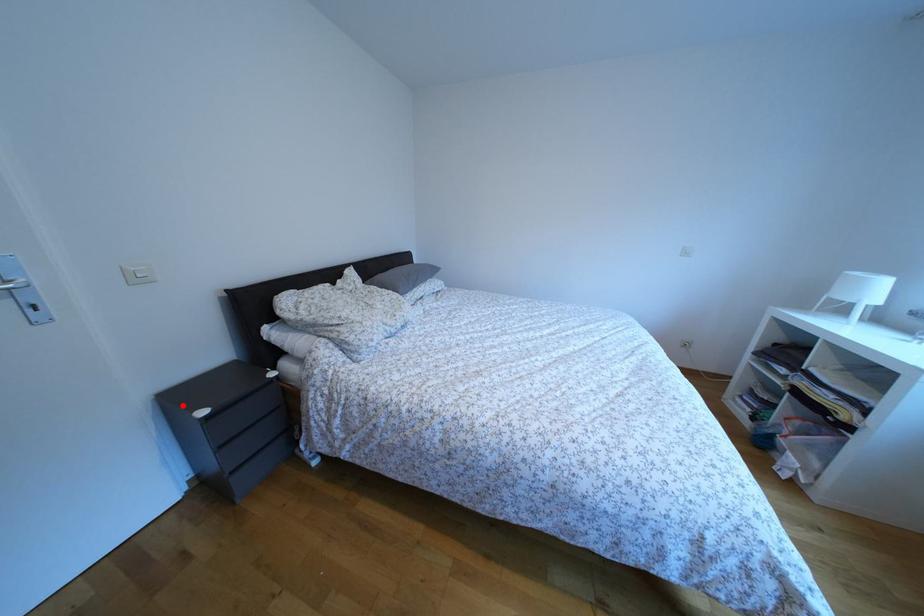
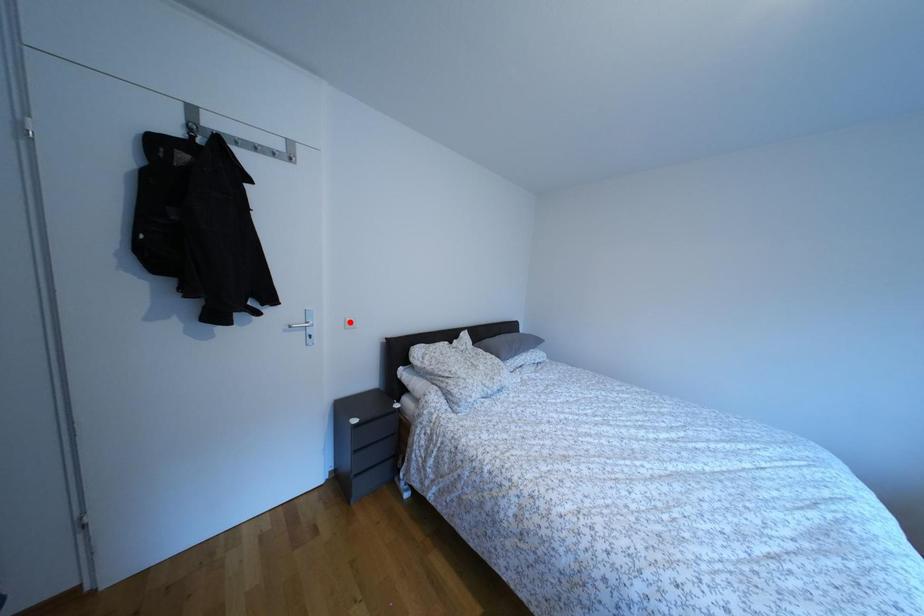
I am providing you with two images of the same scene from different viewpoints. A red point is marked on the first image and another point is marked on the second image. Are the points marked in image1 and image2 representing the same 3D position?

No